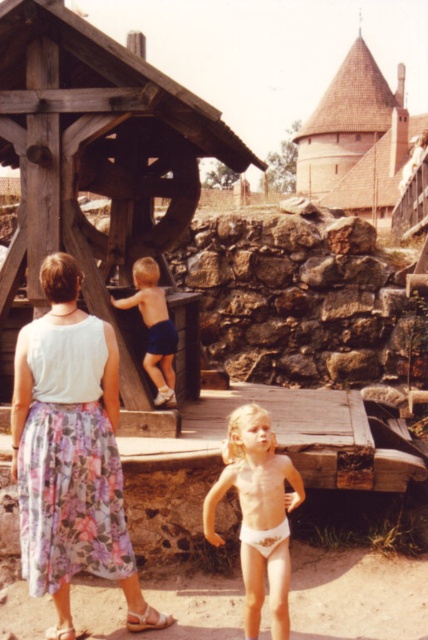
Question: Is wooden gazebo at center behind floral skirt at center?

Choices:
 (A) no
 (B) yes

Answer: (B)

Question: Which point appears closest to the camera in this image?

Choices:
 (A) (80, 380)
 (B) (145, 257)
 (C) (29, 168)

Answer: (A)

Question: Is floral skirt at center above blue denim shorts at center?

Choices:
 (A) yes
 (B) no

Answer: (B)

Question: Is floral skirt at center to the right of tan skin child at center from the viewer's perspective?

Choices:
 (A) no
 (B) yes

Answer: (A)

Question: Estimate the real-world distances between objects in this image. Which object is farther from the tan skin child at center?

Choices:
 (A) blue denim shorts at center
 (B) wooden gazebo at center
 (C) floral skirt at center

Answer: (B)

Question: Which object is positioned farthest from the blue denim shorts at center?

Choices:
 (A) wooden gazebo at center
 (B) floral skirt at center
 (C) tan skin child at center

Answer: (C)